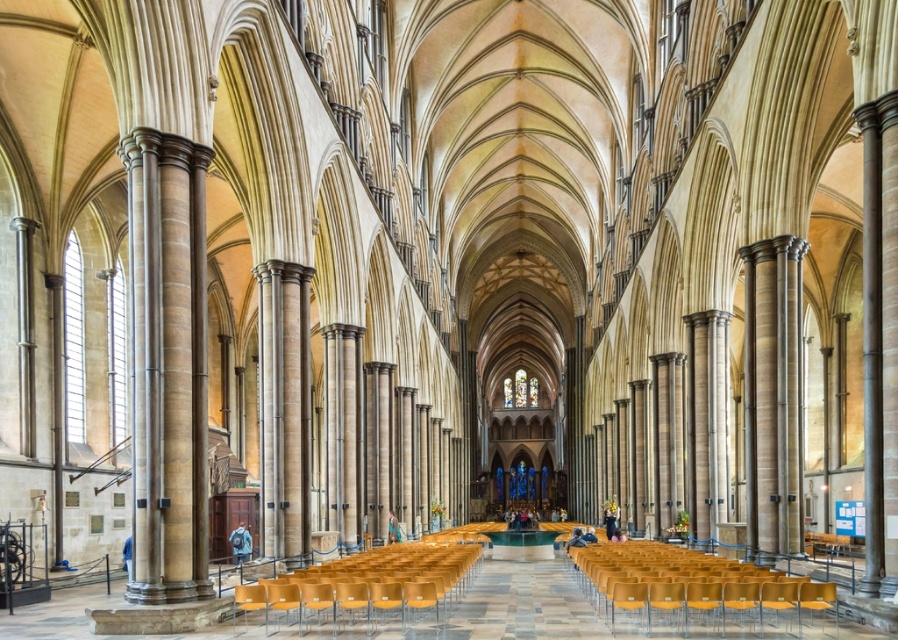
You are standing in the cathedral and see two sets of matte yellow chairs. One is labeled as matte yellow chairs at lower center and the other as matte yellow chairs at center. From your vantage point, which set of chairs is positioned to the right side of the other?

The matte yellow chairs at lower center are to the right of the matte yellow chairs at center.

You are a visitor standing at the entrance of the cathedral. You see two sets of matte yellow chairs at lower center and matte yellow chairs at center. Which set of chairs is closer to your current position?

The matte yellow chairs at lower center is positioned over matte yellow chairs at center, meaning it is closer to your current position at the entrance.